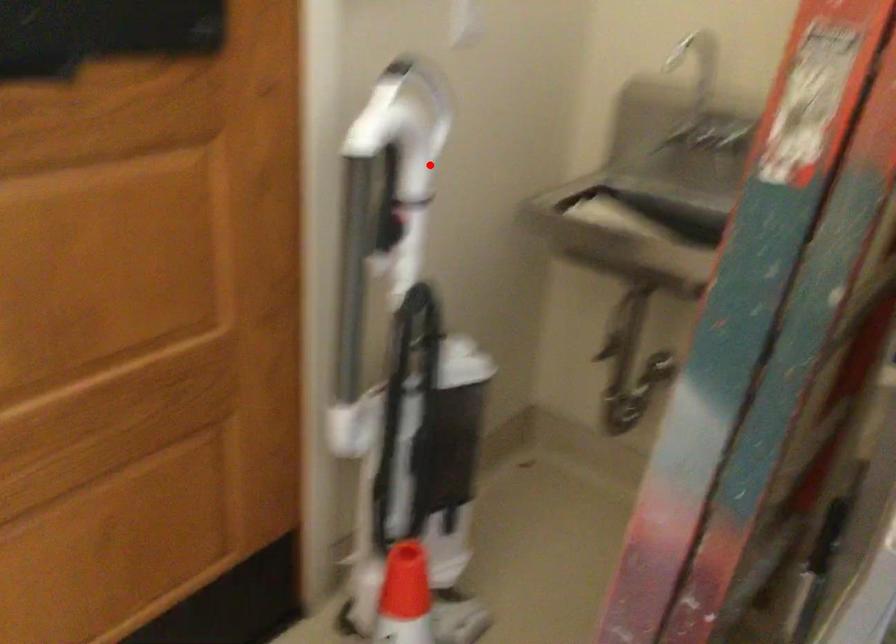
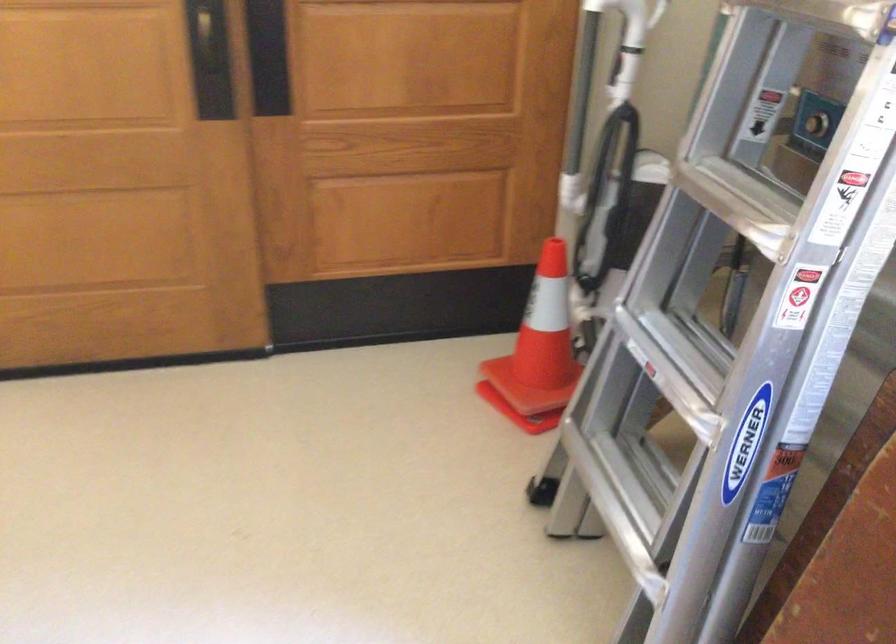
Question: I am providing you with two images of the same scene from different viewpoints. Image1 has a red point marked. In image2, the corresponding 3D location appears at what relative position? Reply with the corresponding letter.

Choices:
 (A) Closer
 (B) Farther

Answer: (B)